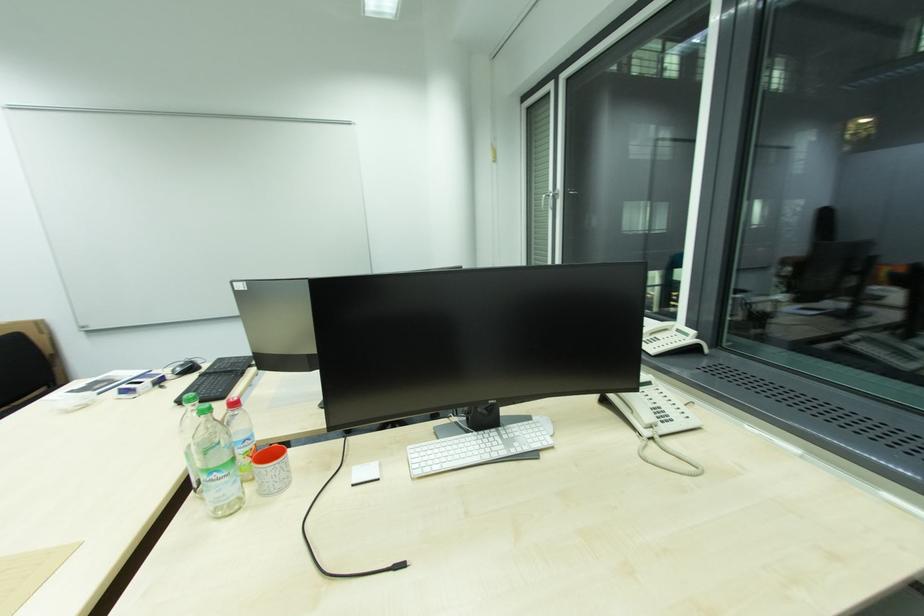
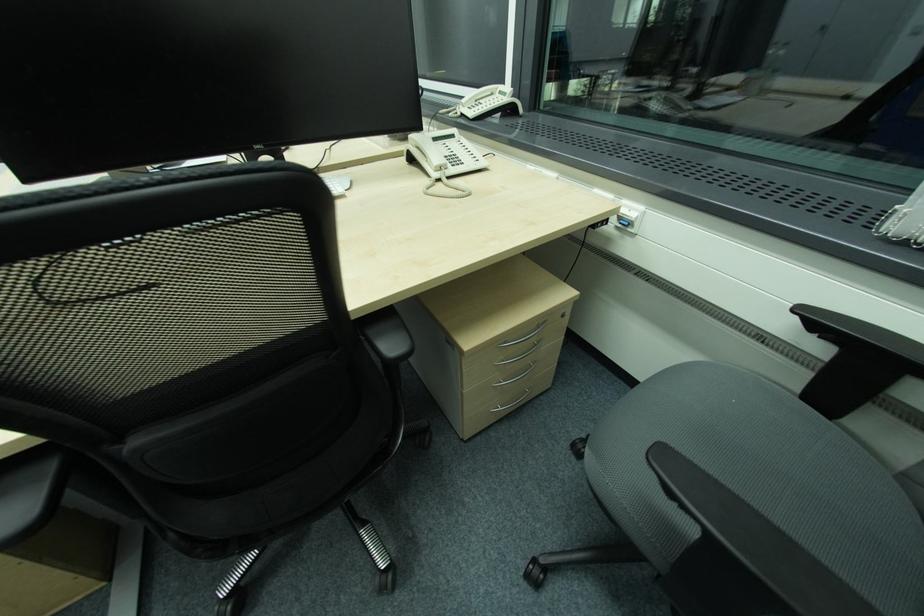
Find the pixel in the second image that matches point (675, 330) in the first image.

(501, 92)